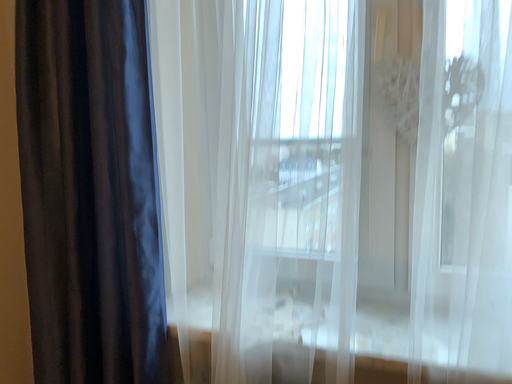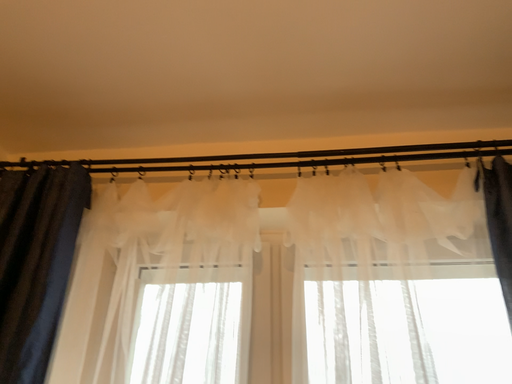
Question: Which way did the camera rotate in the video?

Choices:
 (A) rotated right
 (B) rotated left

Answer: (A)